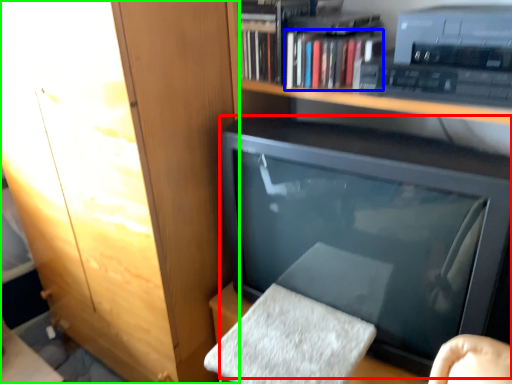
Question: Considering the real-world distances, which object is farthest from television (highlighted by a red box)? book (highlighted by a blue box) or cabinetry (highlighted by a green box)?

Choices:
 (A) book
 (B) cabinetry

Answer: (B)